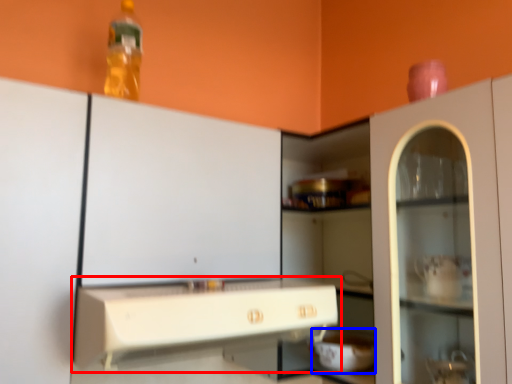
Question: Which object is further to the camera taking this photo, countertop (highlighted by a red box) or appliance (highlighted by a blue box)?

Choices:
 (A) countertop
 (B) appliance

Answer: (B)